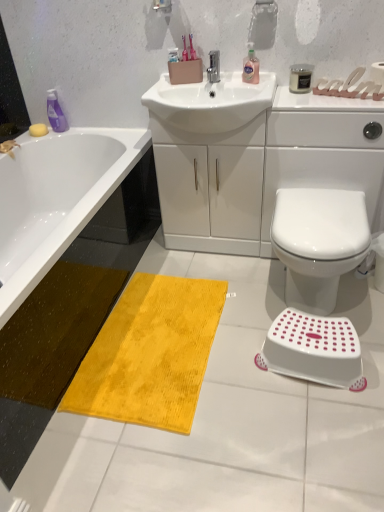
This screenshot has width=384, height=512. What are the coordinates of `empty space that is ontop of white plastic step stool at lower right (from a real-world perspective)` in the screenshot? It's located at (315, 336).